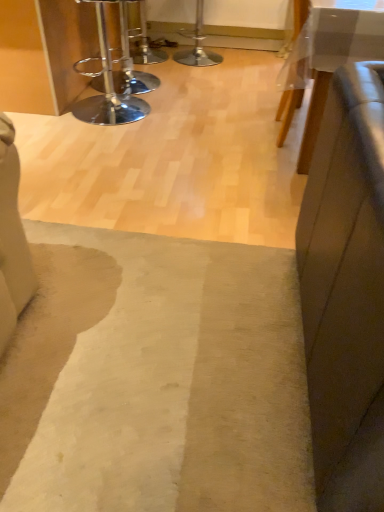
Question: From the image's perspective, is chrome/metallic bar stool at upper left below beige woolen mat at center?

Choices:
 (A) no
 (B) yes

Answer: (A)

Question: From the image's perspective, is chrome/metallic bar stool at upper left above beige woolen mat at center?

Choices:
 (A) yes
 (B) no

Answer: (A)

Question: Considering the relative positions of chrome/metallic bar stool at upper left and beige woolen mat at center in the image provided, is chrome/metallic bar stool at upper left behind beige woolen mat at center?

Choices:
 (A) no
 (B) yes

Answer: (B)

Question: Considering the relative sizes of chrome/metallic bar stool at upper left and beige woolen mat at center in the image provided, is chrome/metallic bar stool at upper left bigger than beige woolen mat at center?

Choices:
 (A) no
 (B) yes

Answer: (B)

Question: From a real-world perspective, is chrome/metallic bar stool at upper left positioned over beige woolen mat at center based on gravity?

Choices:
 (A) no
 (B) yes

Answer: (B)

Question: Would you say chrome/metallic bar stool at upper left contains beige woolen mat at center?

Choices:
 (A) yes
 (B) no

Answer: (B)

Question: Considering the relative sizes of metallic silver bar stool at upper center and beige woolen mat at center in the image provided, is metallic silver bar stool at upper center smaller than beige woolen mat at center?

Choices:
 (A) yes
 (B) no

Answer: (B)

Question: Considering the relative positions of metallic silver bar stool at upper center and beige woolen mat at center in the image provided, is metallic silver bar stool at upper center behind beige woolen mat at center?

Choices:
 (A) yes
 (B) no

Answer: (A)

Question: Can we say metallic silver bar stool at upper center lies outside beige woolen mat at center?

Choices:
 (A) no
 (B) yes

Answer: (B)

Question: Does metallic silver bar stool at upper center turn towards beige woolen mat at center?

Choices:
 (A) yes
 (B) no

Answer: (B)

Question: From the image's perspective, would you say metallic silver bar stool at upper center is positioned over beige woolen mat at center?

Choices:
 (A) yes
 (B) no

Answer: (A)

Question: Is the surface of metallic silver bar stool at upper center in direct contact with beige woolen mat at center?

Choices:
 (A) yes
 (B) no

Answer: (B)

Question: Considering the relative positions of metallic silver bar stool at upper center and white glossy table at upper right in the image provided, is metallic silver bar stool at upper center to the left of white glossy table at upper right from the viewer's perspective?

Choices:
 (A) yes
 (B) no

Answer: (A)